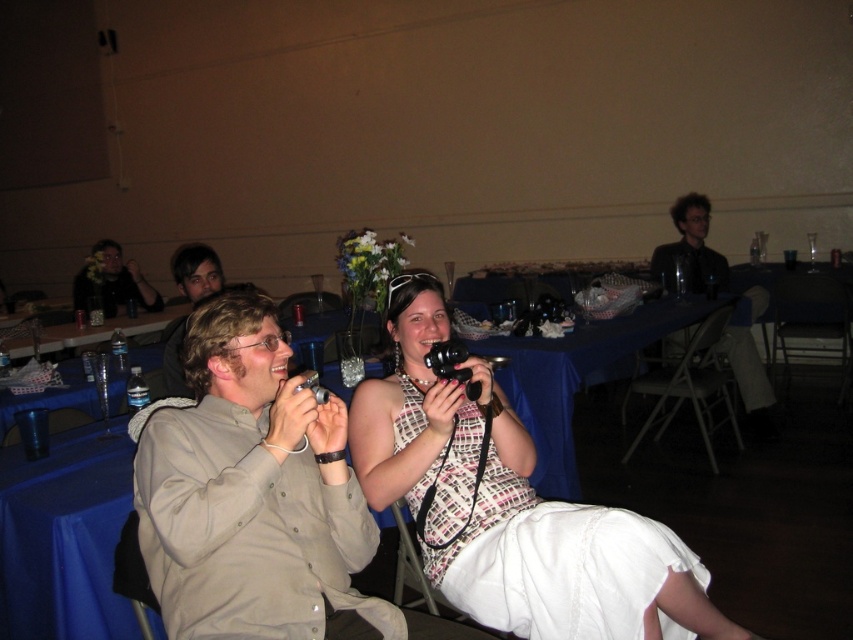
Question: Which point is closer to the camera?

Choices:
 (A) clear plastic water bottles at left
 (B) matte black camera at upper left
 (C) dark gray suit at upper right

Answer: (A)

Question: Can you confirm if beige fabric shirt at center is positioned below blue fabric table at center?

Choices:
 (A) yes
 (B) no

Answer: (A)

Question: Can you confirm if white textured dress at center is thinner than clear plastic water bottles at left?

Choices:
 (A) yes
 (B) no

Answer: (A)

Question: Does light brown hair at center appear on the left side of matte black camera at upper left?

Choices:
 (A) no
 (B) yes

Answer: (A)

Question: Which point appears closest to the camera in this image?

Choices:
 (A) [x=410, y=314]
 (B) [x=207, y=268]

Answer: (A)

Question: Which point is closer to the camera?

Choices:
 (A) matte black camera at upper left
 (B) black plastic camera at center

Answer: (B)